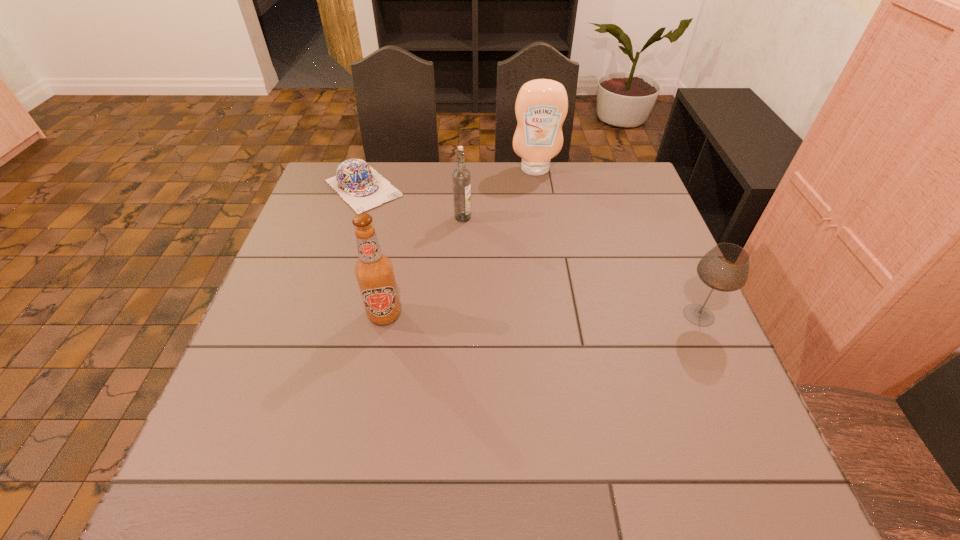
The width and height of the screenshot is (960, 540). I want to click on object that can be found as the fourth closest to the beer bottle, so click(725, 267).

Locate an element on the screen. The image size is (960, 540). free space that satisfies the following two spatial constraints: 1. on the front label of the beer bottle; 2. on the right side of the rightmost object is located at coordinates coord(384,315).

This screenshot has width=960, height=540. Identify the location of vacant space that satisfies the following two spatial constraints: 1. on the back side of the condiment; 2. on the left side of the cap. (370, 170).